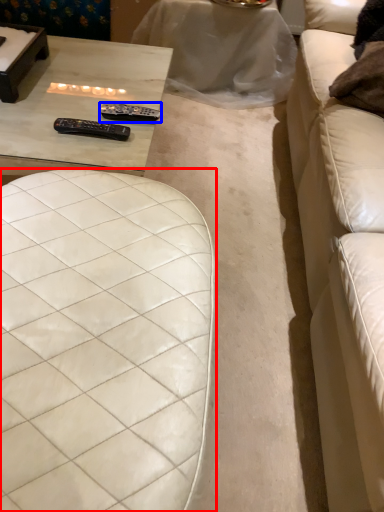
Question: Which object is further to the camera taking this photo, furniture (highlighted by a red box) or remote (highlighted by a blue box)?

Choices:
 (A) furniture
 (B) remote

Answer: (B)